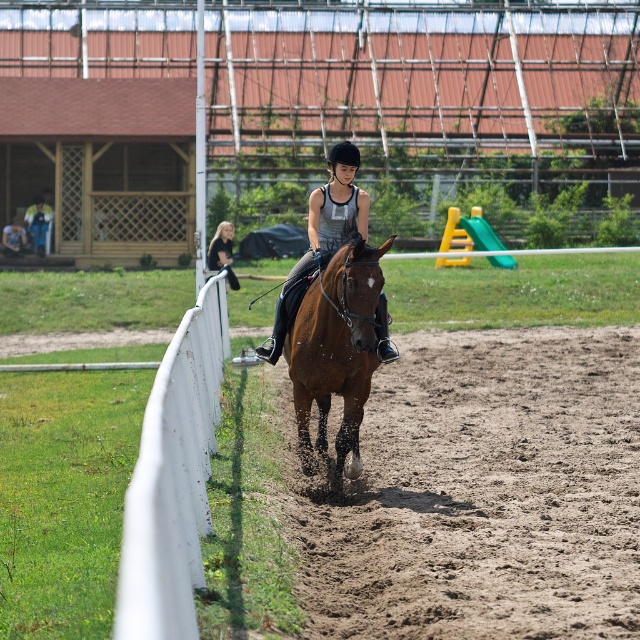
Question: Estimate the real-world distances between objects in this image. Which object is closer to the shiny black helmet at center?

Choices:
 (A) black leather jacket at upper center
 (B) brown glossy horse at center
 (C) white painted wood at left

Answer: (B)

Question: Can you confirm if white painted wood at left is wider than shiny black helmet at center?

Choices:
 (A) yes
 (B) no

Answer: (A)

Question: Can you confirm if brown glossy horse at center is positioned below shiny black helmet at center?

Choices:
 (A) no
 (B) yes

Answer: (B)

Question: Which object is closer to the camera taking this photo?

Choices:
 (A) black leather jacket at upper center
 (B) white painted wood at left

Answer: (B)

Question: Is white painted wood at left thinner than brown glossy horse at center?

Choices:
 (A) yes
 (B) no

Answer: (B)

Question: Which of the following is the closest to the observer?

Choices:
 (A) (280, 346)
 (B) (289, 372)
 (C) (224, 262)
 (D) (168, 362)

Answer: (D)